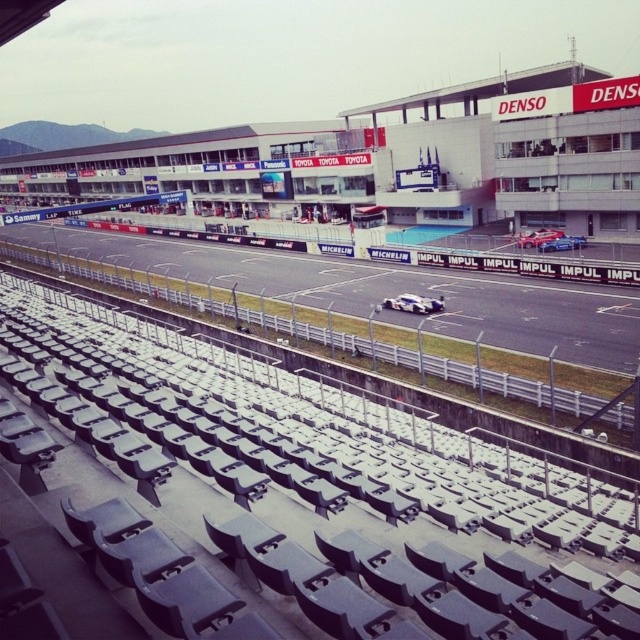
Can you confirm if black asphalt race track at center is bigger than blue metallic car at center?

Indeed, black asphalt race track at center has a larger size compared to blue metallic car at center.

The width and height of the screenshot is (640, 640). What do you see at coordinates (385, 291) in the screenshot?
I see `black asphalt race track at center` at bounding box center [385, 291].

Identify the location of black asphalt race track at center. The height and width of the screenshot is (640, 640). (385, 291).

At what (x,y) coordinates should I click in order to perform the action: click on black asphalt race track at center. Please return your answer as a coordinate pair (x, y). This screenshot has height=640, width=640. Looking at the image, I should click on (385, 291).

Does white matte race car at center appear on the right side of blue metallic car at center?

In fact, white matte race car at center is to the left of blue metallic car at center.

Does white matte race car at center appear on the left side of blue metallic car at center?

Yes, white matte race car at center is to the left of blue metallic car at center.

Who is more distant from viewer, (417,298) or (561,236)?

Point (561,236)

Identify the location of white matte race car at center. Image resolution: width=640 pixels, height=640 pixels. (413, 304).

Based on the photo, who is shorter, black asphalt race track at center or white matte race car at center?

white matte race car at center is shorter.

Which is behind, point (317, 266) or point (394, 307)?

Positioned behind is point (317, 266).

Which is in front, point (45, 244) or point (412, 310)?

Positioned in front is point (412, 310).

Where is `black asphalt race track at center`? The image size is (640, 640). black asphalt race track at center is located at coordinates (385, 291).